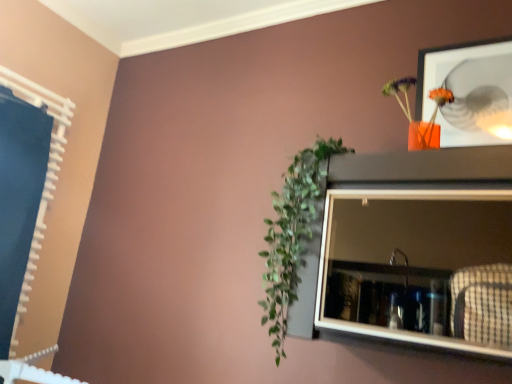
Question: From a real-world perspective, is green leafy plant at center-left located beneath orange matte vase at upper right?

Choices:
 (A) no
 (B) yes

Answer: (B)

Question: From the image's perspective, is green leafy plant at center-left on top of orange matte vase at upper right?

Choices:
 (A) yes
 (B) no

Answer: (B)

Question: Considering the relative sizes of green leafy plant at center-left and orange matte vase at upper right in the image provided, is green leafy plant at center-left shorter than orange matte vase at upper right?

Choices:
 (A) no
 (B) yes

Answer: (A)

Question: Can you confirm if green leafy plant at center-left is wider than orange matte vase at upper right?

Choices:
 (A) no
 (B) yes

Answer: (B)

Question: Is green leafy plant at center-left outside orange matte vase at upper right?

Choices:
 (A) yes
 (B) no

Answer: (A)

Question: Does green leafy plant at center-left turn towards orange matte vase at upper right?

Choices:
 (A) yes
 (B) no

Answer: (B)

Question: Could matte gray medicine cabinet at upper right be considered to be inside orange matte vase at upper right?

Choices:
 (A) no
 (B) yes

Answer: (A)

Question: Is orange matte vase at upper right facing towards matte gray medicine cabinet at upper right?

Choices:
 (A) yes
 (B) no

Answer: (B)

Question: Can you confirm if orange matte vase at upper right is taller than matte gray medicine cabinet at upper right?

Choices:
 (A) yes
 (B) no

Answer: (B)

Question: Are orange matte vase at upper right and matte gray medicine cabinet at upper right located far from each other?

Choices:
 (A) yes
 (B) no

Answer: (B)

Question: Is orange matte vase at upper right beside matte gray medicine cabinet at upper right?

Choices:
 (A) no
 (B) yes

Answer: (A)

Question: Considering the relative positions of orange matte vase at upper right and matte gray medicine cabinet at upper right in the image provided, is orange matte vase at upper right to the right of matte gray medicine cabinet at upper right from the viewer's perspective?

Choices:
 (A) yes
 (B) no

Answer: (A)

Question: Could you tell me if matte gray medicine cabinet at upper right is facing green leafy plant at center-left?

Choices:
 (A) yes
 (B) no

Answer: (B)